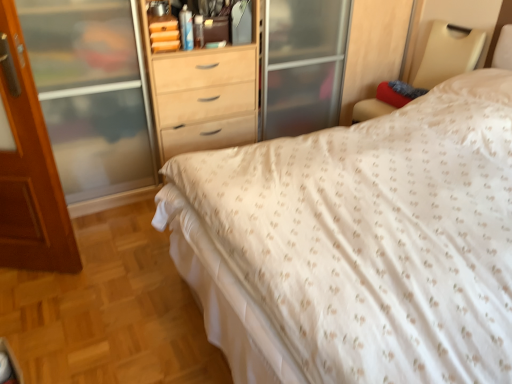
Question: Should I look upward or downward to see white textured bed at center?

Choices:
 (A) up
 (B) down

Answer: (B)

Question: Does white fabric bed frame at upper right have a greater width compared to brown wooden door at left?

Choices:
 (A) no
 (B) yes

Answer: (B)

Question: Is white fabric bed frame at upper right completely or partially outside of brown wooden door at left?

Choices:
 (A) no
 (B) yes

Answer: (B)

Question: Is white fabric bed frame at upper right not near brown wooden door at left?

Choices:
 (A) yes
 (B) no

Answer: (A)

Question: Is white fabric bed frame at upper right to the left of brown wooden door at left from the viewer's perspective?

Choices:
 (A) no
 (B) yes

Answer: (A)

Question: From the image's perspective, is white fabric bed frame at upper right on brown wooden door at left?

Choices:
 (A) no
 (B) yes

Answer: (B)

Question: Is white fabric bed frame at upper right to the right of brown wooden door at left from the viewer's perspective?

Choices:
 (A) no
 (B) yes

Answer: (B)

Question: From a real-world perspective, is white textured bed at center positioned over matte wood dresser at center based on gravity?

Choices:
 (A) yes
 (B) no

Answer: (B)

Question: Does white textured bed at center turn towards matte wood dresser at center?

Choices:
 (A) no
 (B) yes

Answer: (A)

Question: Is white textured bed at center positioned behind matte wood dresser at center?

Choices:
 (A) no
 (B) yes

Answer: (A)

Question: Does white textured bed at center have a lesser height compared to matte wood dresser at center?

Choices:
 (A) no
 (B) yes

Answer: (B)

Question: Considering the relative sizes of white textured bed at center and matte wood dresser at center in the image provided, is white textured bed at center taller than matte wood dresser at center?

Choices:
 (A) yes
 (B) no

Answer: (B)

Question: Considering the relative sizes of white textured bed at center and matte wood dresser at center in the image provided, is white textured bed at center smaller than matte wood dresser at center?

Choices:
 (A) no
 (B) yes

Answer: (A)

Question: Does matte wood dresser at center lie behind brown wooden door at left?

Choices:
 (A) no
 (B) yes

Answer: (B)